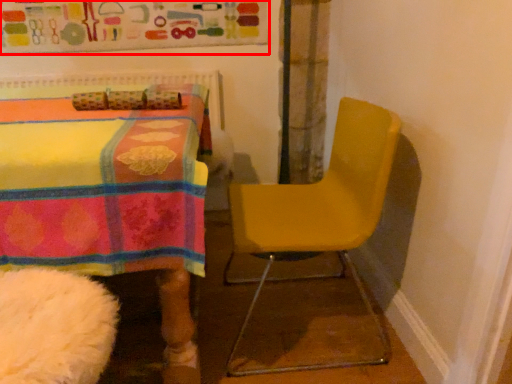
Question: From the image, what is the correct spatial relationship of bulletin board (annotated by the red box) in relation to chair?

Choices:
 (A) left
 (B) right

Answer: (A)